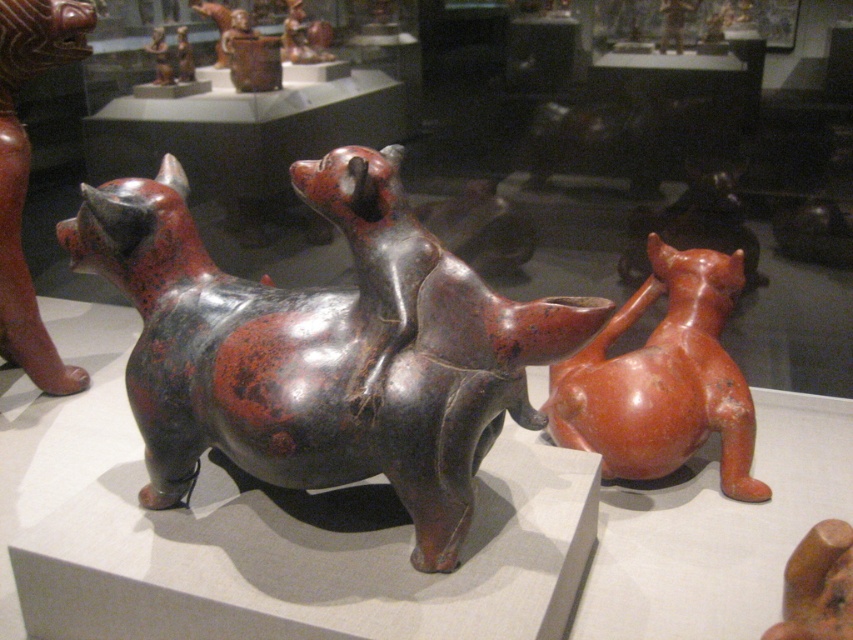
Is point (724, 456) positioned before point (42, 51)?

Yes, point (724, 456) is in front of point (42, 51).

Based on the photo, is matte orange vase at right to the left of matte black cat at left from the viewer's perspective?

No, matte orange vase at right is not to the left of matte black cat at left.

What do you see at coordinates (662, 380) in the screenshot? The height and width of the screenshot is (640, 853). I see `matte orange vase at right` at bounding box center [662, 380].

Find the location of a particular element. This screenshot has width=853, height=640. matte orange vase at right is located at coordinates (662, 380).

Which is more to the left, matte black dog at center or matte orange vase at right?

Positioned to the left is matte black dog at center.

Can you confirm if matte black dog at center is smaller than matte orange vase at right?

Incorrect, matte black dog at center is not smaller in size than matte orange vase at right.

The height and width of the screenshot is (640, 853). What are the coordinates of `matte black dog at center` in the screenshot? It's located at (322, 348).

Is matte black dog at center above matte black cat at left?

No, matte black dog at center is not above matte black cat at left.

Does matte black dog at center have a smaller size compared to matte black cat at left?

Yes, matte black dog at center is smaller than matte black cat at left.

Does point (473, 387) lie behind point (90, 20)?

That is False.

At what (x,y) coordinates should I click in order to perform the action: click on matte black dog at center. Please return your answer as a coordinate pair (x, y). Looking at the image, I should click on (322, 348).